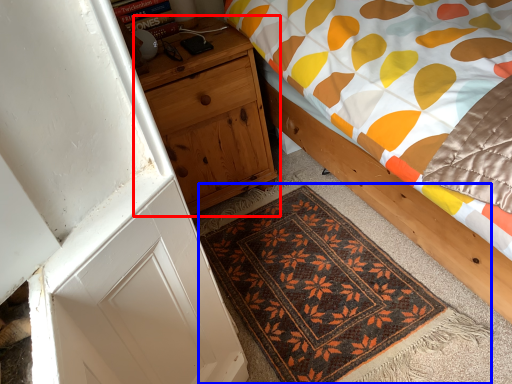
Question: Which point is closer to the camera, nightstand (highlighted by a red box) or mat (highlighted by a blue box)?

Choices:
 (A) nightstand
 (B) mat

Answer: (B)